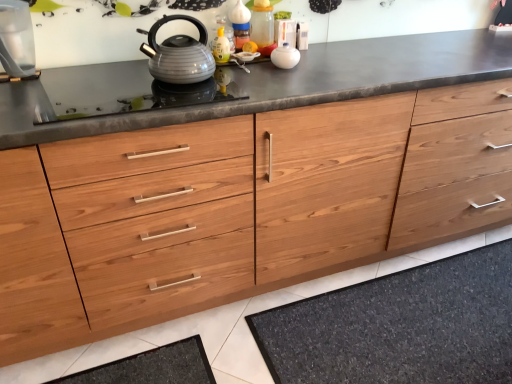
Question: Is transparent glass water at left, the first appliance positioned from the left, smaller than black glass gas stove at center?

Choices:
 (A) yes
 (B) no

Answer: (B)

Question: Is black glass gas stove at center inside transparent glass water at left, the second appliance in the right-to-left sequence?

Choices:
 (A) no
 (B) yes

Answer: (A)

Question: Is transparent glass water at left, the second appliance in the right-to-left sequence, oriented away from black glass gas stove at center?

Choices:
 (A) no
 (B) yes

Answer: (A)

Question: Can you see transparent glass water at left, the first appliance positioned from the left, touching black glass gas stove at center?

Choices:
 (A) no
 (B) yes

Answer: (A)

Question: Considering the relative positions of transparent glass water at left, the second appliance in the right-to-left sequence, and black glass gas stove at center in the image provided, is transparent glass water at left, the second appliance in the right-to-left sequence, to the right of black glass gas stove at center from the viewer's perspective?

Choices:
 (A) yes
 (B) no

Answer: (B)

Question: Is transparent glass water at left, the second appliance in the right-to-left sequence, shorter than black glass gas stove at center?

Choices:
 (A) yes
 (B) no

Answer: (B)

Question: Is black glass gas stove at center in front of dark gray textured bath mat at lower center?

Choices:
 (A) yes
 (B) no

Answer: (A)

Question: Is black glass gas stove at center next to dark gray textured bath mat at lower center and touching it?

Choices:
 (A) no
 (B) yes

Answer: (A)

Question: Is black glass gas stove at center bigger than dark gray textured bath mat at lower center?

Choices:
 (A) no
 (B) yes

Answer: (A)

Question: Is dark gray textured bath mat at lower center completely or partially inside black glass gas stove at center?

Choices:
 (A) no
 (B) yes

Answer: (A)

Question: From a real-world perspective, is black glass gas stove at center physically above dark gray textured bath mat at lower center?

Choices:
 (A) yes
 (B) no

Answer: (A)

Question: From a real-world perspective, is black glass gas stove at center located beneath dark gray textured bath mat at lower center?

Choices:
 (A) yes
 (B) no

Answer: (B)

Question: From a real-world perspective, is matte gray kettle at center on top of black glass gas stove at center?

Choices:
 (A) no
 (B) yes

Answer: (B)